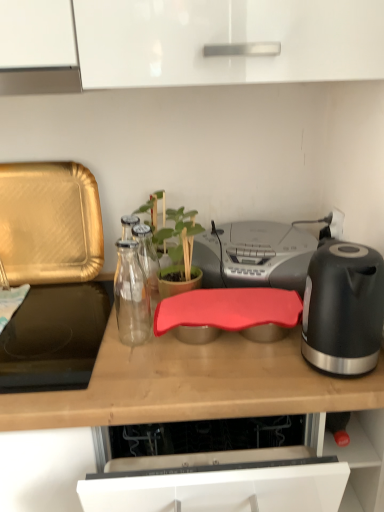
I want to click on empty space that is ontop of gold textured tray at left (from a real-world perspective), so click(43, 160).